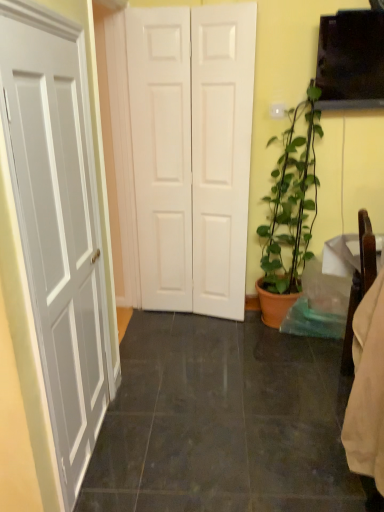
Describe the element at coordinates (289, 211) in the screenshot. I see `matte terracotta pot at right` at that location.

Find the location of a particular element. matte terracotta pot at right is located at coordinates (289, 211).

Is white matte door at center directly adjacent to black glossy tile at center?

No, white matte door at center is not beside black glossy tile at center.

From the picture: Is white matte door at center inside the boundaries of black glossy tile at center, or outside?

white matte door at center lies outside black glossy tile at center.

From a real-world perspective, who is located lower, white matte door at center or black glossy tile at center?

black glossy tile at center.

Can you confirm if white matte door at center is taller than black glossy tile at center?

Yes, white matte door at center is taller than black glossy tile at center.

From the image's perspective, is matte terracotta pot at right under white matte door at center?

Yes, from the image's perspective, matte terracotta pot at right is beneath white matte door at center.

Is matte terracotta pot at right at the right side of white matte door at center?

Correct, you'll find matte terracotta pot at right to the right of white matte door at center.

Does point (313, 219) come closer to viewer compared to point (226, 111)?

No.

There is a matte terracotta pot at right. Find the location of `door above it (from a real-world perspective)`. door above it (from a real-world perspective) is located at coordinates (221, 155).

Consider the image. Is white matte door at center smaller than matte terracotta pot at right?

Correct, white matte door at center occupies less space than matte terracotta pot at right.

Is white matte door at center located outside matte terracotta pot at right?

white matte door at center is positioned outside matte terracotta pot at right.

Would you say black glossy tile at center is inside or outside matte terracotta pot at right?

black glossy tile at center is not inside matte terracotta pot at right, it's outside.

Considering the sizes of objects black glossy tile at center and matte terracotta pot at right in the image provided, who is thinner, black glossy tile at center or matte terracotta pot at right?

matte terracotta pot at right.

Is black glossy tile at center turned away from matte terracotta pot at right?

No.

Which is behind, point (344, 506) or point (238, 64)?

The point (238, 64) is farther.

The image size is (384, 512). What are the coordinates of `door that is on the left side of black glossy tile at center` in the screenshot? It's located at point(221,155).

In terms of size, does black glossy tile at center appear bigger or smaller than white matte door at center?

Considering their sizes, black glossy tile at center takes up less space than white matte door at center.

Who is smaller, matte terracotta pot at right or black glossy tile at center?

black glossy tile at center.

From the picture: Are matte terracotta pot at right and black glossy tile at center beside each other?

No, matte terracotta pot at right is not next to black glossy tile at center.

From the image's perspective, is matte terracotta pot at right on black glossy tile at center?

Yes.

Which object is positioned more to the right, matte terracotta pot at right or black glossy tile at center?

Positioned to the right is matte terracotta pot at right.

Locate an element on the screen. Image resolution: width=384 pixels, height=512 pixels. door on the left side of black glossy tile at center is located at coordinates (221, 155).

Locate an element on the screen. The image size is (384, 512). houseplant lying on the right of white matte door at center is located at coordinates (289, 211).

Estimate the real-world distances between objects in this image. Which object is further from black glossy tile at center, matte terracotta pot at right or white matte door at center?

white matte door at center is further to black glossy tile at center.

Considering their positions, is matte terracotta pot at right positioned closer to white matte door at center than black glossy tile at center?

matte terracotta pot at right is closer to white matte door at center.

Which object lies further to the anchor point black glossy tile at center, white matte door at center or matte terracotta pot at right?

white matte door at center is further to black glossy tile at center.

When comparing their distances from matte terracotta pot at right, does white matte door at center or black glossy tile at center seem further?

Among the two, black glossy tile at center is located further to matte terracotta pot at right.

Which object lies nearer to the anchor point white matte door at center, black glossy tile at center or matte terracotta pot at right?

matte terracotta pot at right is closer to white matte door at center.

Estimate the real-world distances between objects in this image. Which object is closer to matte terracotta pot at right, black glossy tile at center or white matte door at center?

Among the two, white matte door at center is located nearer to matte terracotta pot at right.

The width and height of the screenshot is (384, 512). In order to click on houseplant that lies between white matte door at center and black glossy tile at center from top to bottom in this screenshot , I will do `click(289, 211)`.